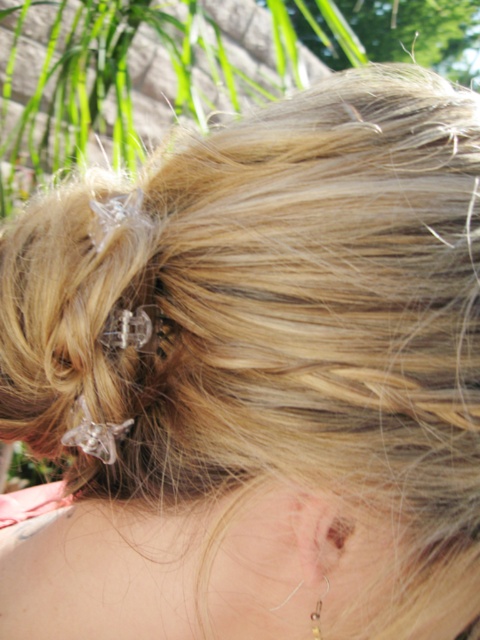
From the picture: You are a photographer trying to capture the gold metallic earring at lower center without the pale skin ear at lower center blocking it. Based on their positions, can you adjust your angle to frame the earring without the ear in the shot?

The pale skin ear at lower center is above the gold metallic earring at lower center, so you can lower your camera angle slightly to frame the earring below the ear, thus avoiding obstruction.

You are a photographer adjusting the camera focus. You need to ensure both the pale skin ear at lower center and the gold metallic earring at lower center are in focus. Which object should you adjust the focus to prioritize first?

The pale skin ear at lower center is much taller than the gold metallic earring at lower center, so you should prioritize focusing on the pale skin ear at lower center first because it is larger and more prominent in the frame.

You are a photographer adjusting lighting for a portrait. You notice the pale skin ear at lower center and the gold metallic earring at lower center in the frame. Which object appears wider in the image?

The pale skin ear at lower center appears wider than the gold metallic earring at lower center because the pale skin ear at lower center has a larger width according to the description.